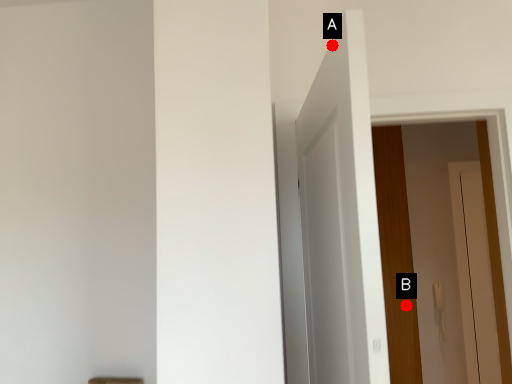
Question: Two points are circled on the image, labeled by A and B beside each circle. Which point appears farthest from the camera in this image?

Choices:
 (A) A is further
 (B) B is further

Answer: (B)